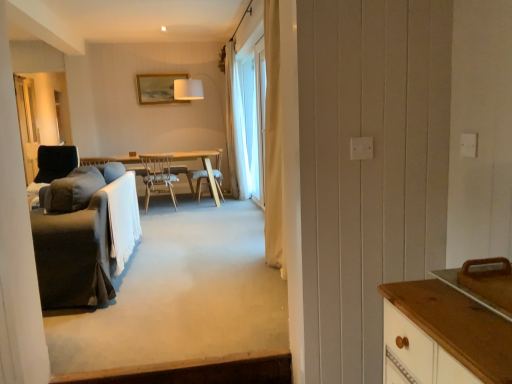
Where is `wooden chair at center, the second chair positioned from the front`? wooden chair at center, the second chair positioned from the front is located at coordinates (198, 181).

Locate an element on the screen. soft gray carpet at center is located at coordinates (183, 306).

What do you see at coordinates (204, 168) in the screenshot?
I see `light wood table at center` at bounding box center [204, 168].

Describe the element at coordinates (158, 88) in the screenshot. This screenshot has height=384, width=512. I see `wooden frame at upper center` at that location.

Image resolution: width=512 pixels, height=384 pixels. What are the coordinates of `white sheer curtain at center` in the screenshot? It's located at 254,108.

From a real-world perspective, is light wood table at center located higher than soft gray carpet at center?

Yes, from a real-world perspective, light wood table at center is over soft gray carpet at center

You are a GUI agent. You are given a task and a screenshot of the screen. Output one action in this format:
    pyautogui.click(x=<x>, y=<y>)
    Task: Click on the table on the left of soft gray carpet at center
    The height and width of the screenshot is (384, 512).
    Given the screenshot: What is the action you would take?
    pyautogui.click(x=204, y=168)

Could you tell me if light wood table at center is facing soft gray carpet at center?

Yes, light wood table at center is aimed at soft gray carpet at center.

Could you tell me if wooden chair at center, the first chair positioned from the back, is facing dark gray fabric couch at left?

No.

What's the angular difference between wooden chair at center, the second chair positioned from the front, and dark gray fabric couch at left's facing directions?

wooden chair at center, the second chair positioned from the front, and dark gray fabric couch at left are facing 7.58 degrees away from each other.

Between wooden chair at center, placed as the second chair when sorted from left to right, and dark gray fabric couch at left, which one appears on the left side from the viewer's perspective?

Positioned to the left is dark gray fabric couch at left.

Find the location of a particular element. The width and height of the screenshot is (512, 384). studio couch on the left of wooden chair at center, the 1th chair viewed from the right is located at coordinates (83, 236).

From a real-world perspective, relative to dark gray fabric couch at left, is wooden chair at center, the first chair from the front, vertically above or below?

From a real-world perspective, wooden chair at center, the first chair from the front, is physically below dark gray fabric couch at left.

Where is `the 1st chair behind the dark gray fabric couch at left, counting from the anchor's position`? The height and width of the screenshot is (384, 512). the 1st chair behind the dark gray fabric couch at left, counting from the anchor's position is located at coordinates tap(158, 177).

Which object is more forward, wooden chair at center, which is the second chair from right to left, or dark gray fabric couch at left?

Positioned in front is dark gray fabric couch at left.

Is wooden chair at center, which is the second chair in back-to-front order, located outside dark gray fabric couch at left?

Yes, wooden chair at center, which is the second chair in back-to-front order, is outside of dark gray fabric couch at left.

Is soft gray carpet at center wider than wooden frame at upper center?

Yes, soft gray carpet at center is wider than wooden frame at upper center.

From a real-world perspective, is soft gray carpet at center on top of wooden frame at upper center?

Actually, soft gray carpet at center is physically below wooden frame at upper center in the real world.

Is soft gray carpet at center not near wooden frame at upper center?

Yes, soft gray carpet at center is far from wooden frame at upper center.

Considering the sizes of soft gray carpet at center and wooden frame at upper center in the image, is soft gray carpet at center bigger or smaller than wooden frame at upper center?

In the image, soft gray carpet at center appears to be larger than wooden frame at upper center.

Is wooden frame at upper center completely or partially outside of wooden chair at center, arranged as the first chair when viewed from the left?

Yes, wooden frame at upper center is not within wooden chair at center, arranged as the first chair when viewed from the left.

Is wooden frame at upper center at the left side of wooden chair at center, which is the second chair from right to left?

Correct, you'll find wooden frame at upper center to the left of wooden chair at center, which is the second chair from right to left.

Which point is more forward, (149, 92) or (167, 167)?

The point (167, 167) is closer to the camera.

From the image's perspective, is wooden frame at upper center below wooden chair at center, which is the second chair in back-to-front order?

No.

Considering the relative sizes of wooden chair at center, the second chair positioned from the front, and black fabric screen door at left in the image provided, is wooden chair at center, the second chair positioned from the front, taller than black fabric screen door at left?

No, wooden chair at center, the second chair positioned from the front, is not taller than black fabric screen door at left.

From the picture: Which is behind, wooden chair at center, the 1th chair viewed from the right, or black fabric screen door at left?

black fabric screen door at left is further away from the camera.

From the image's perspective, would you say wooden chair at center, placed as the second chair when sorted from left to right, is shown under black fabric screen door at left?

Yes, from the image's perspective, wooden chair at center, placed as the second chair when sorted from left to right, is beneath black fabric screen door at left.

Which is closer, (200, 185) or (34, 126)?

Point (200, 185).

From a real-world perspective, between black fabric screen door at left and wooden frame at upper center, who is vertically lower?

black fabric screen door at left.

Is black fabric screen door at left taller or shorter than wooden frame at upper center?

Considering their sizes, black fabric screen door at left has more height than wooden frame at upper center.

What's the angular difference between black fabric screen door at left and wooden frame at upper center's facing directions?

black fabric screen door at left and wooden frame at upper center are facing 90.6 degrees away from each other.

Image resolution: width=512 pixels, height=384 pixels. What are the coordinates of `plain in front of the light wood table at center` in the screenshot? It's located at (183, 306).

You are a GUI agent. You are given a task and a screenshot of the screen. Output one action in this format:
    pyautogui.click(x=<x>, y=<y>)
    Task: Click on the studio couch on the left of wooden chair at center, the 1th chair viewed from the right
    
    Given the screenshot: What is the action you would take?
    pyautogui.click(x=83, y=236)

Estimate the real-world distances between objects in this image. Which object is further from white sheer curtain at center, soft gray carpet at center or black fabric screen door at left?

The object further to white sheer curtain at center is black fabric screen door at left.

Based on their spatial positions, is white sheer curtain at upper center or white sheer curtain at center further from dark gray fabric couch at left?

white sheer curtain at upper center.

Estimate the real-world distances between objects in this image. Which object is further from black fabric screen door at left, light wood table at center or wooden frame at upper center?

The object further to black fabric screen door at left is light wood table at center.

From the picture: Considering their positions, is black fabric screen door at left positioned closer to wooden chair at center, arranged as the first chair when viewed from the left, than white sheer curtain at upper center?

Among the two, white sheer curtain at upper center is located nearer to wooden chair at center, arranged as the first chair when viewed from the left.

From the image, which object appears to be nearer to white sheer curtain at center, black fabric screen door at left or wooden frame at upper center?

The object closer to white sheer curtain at center is wooden frame at upper center.

Looking at the image, which one is located further to white sheer curtain at upper center, wooden chair at center, which is the second chair in back-to-front order, or soft gray carpet at center?

soft gray carpet at center is further to white sheer curtain at upper center.

Which object lies further to the anchor point white sheer curtain at upper center, wooden frame at upper center or dark gray fabric couch at left?

Based on the image, dark gray fabric couch at left appears to be further to white sheer curtain at upper center.

From the image, which object appears to be nearer to white sheer curtain at upper center, white sheer curtain at center or light wood table at center?

light wood table at center is closer to white sheer curtain at upper center.

Locate an element on the screen. The image size is (512, 384). picture frame between black fabric screen door at left and white sheer curtain at center from left to right is located at coordinates (158, 88).

Where is `window screen positioned between soft gray carpet at center and black fabric screen door at left from near to far`? The image size is (512, 384). window screen positioned between soft gray carpet at center and black fabric screen door at left from near to far is located at coordinates (254, 108).

You are a GUI agent. You are given a task and a screenshot of the screen. Output one action in this format:
    pyautogui.click(x=<x>, y=<y>)
    Task: Click on the curtain between wooden frame at upper center and wooden chair at center, which is the second chair from right to left, vertically
    This screenshot has width=512, height=384.
    Given the screenshot: What is the action you would take?
    pyautogui.click(x=236, y=129)

Find the location of `picture frame between black fabric screen door at left and white sheer curtain at center`. picture frame between black fabric screen door at left and white sheer curtain at center is located at coordinates (158, 88).